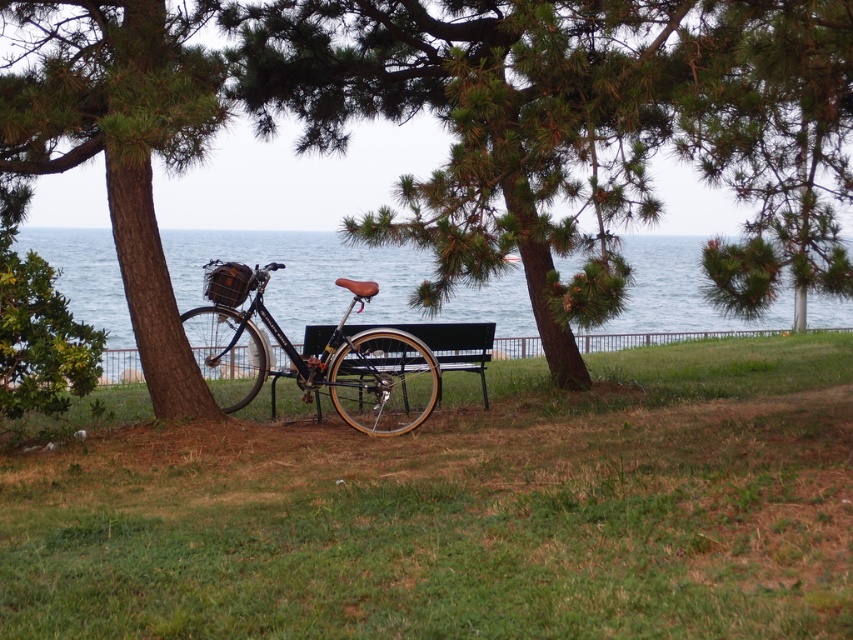
Does blue water at center have a greater height compared to shiny black bicycle at center?

Indeed, blue water at center has a greater height compared to shiny black bicycle at center.

Which is below, blue water at center or shiny black bicycle at center?

Positioned lower is shiny black bicycle at center.

What do you see at coordinates (300, 273) in the screenshot? This screenshot has height=640, width=853. I see `blue water at center` at bounding box center [300, 273].

Image resolution: width=853 pixels, height=640 pixels. Identify the location of blue water at center. (300, 273).

Between blue water at center and black metal bench at center, which one has more height?

Standing taller between the two is blue water at center.

Can you confirm if blue water at center is positioned below black metal bench at center?

No, blue water at center is not below black metal bench at center.

Describe the element at coordinates (300, 273) in the screenshot. The image size is (853, 640). I see `blue water at center` at that location.

Find the location of a particular element. This screenshot has height=640, width=853. blue water at center is located at coordinates (300, 273).

Who is higher up, green grass at center or black metal bench at center?

Positioned higher is black metal bench at center.

Who is lower down, green grass at center or black metal bench at center?

green grass at center is lower down.

Find the location of a particular element. green grass at center is located at coordinates (463, 513).

Find the location of `green grass at center`. green grass at center is located at coordinates (463, 513).